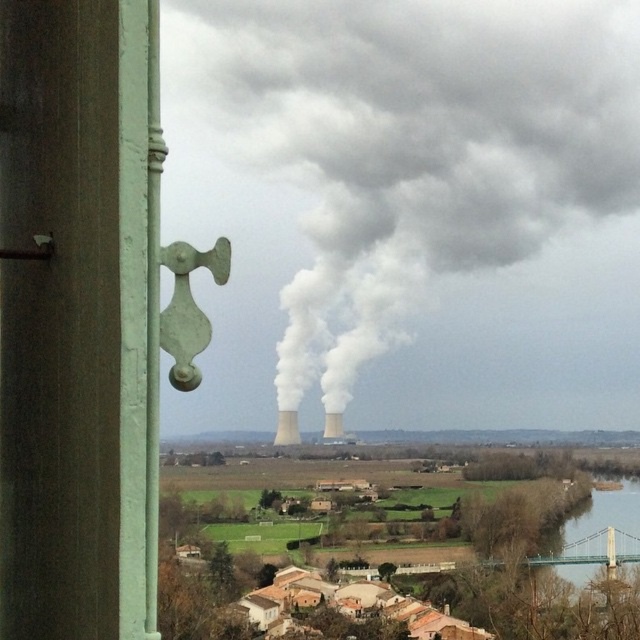
Where is `smooth concrete chimney at center`? The image size is (640, 640). smooth concrete chimney at center is located at coordinates (285, 428).

From the picture: Between smooth concrete chimney at center and white matte tower at center, which one is positioned lower?

Positioned lower is smooth concrete chimney at center.

Who is more forward, (x=278, y=444) or (x=339, y=428)?

Point (x=339, y=428) is more forward.

Find the location of a particular element. smooth concrete chimney at center is located at coordinates (285, 428).

Who is more distant from viewer, (419, 141) or (326, 426)?

The point (419, 141) is more distant.

Describe the element at coordinates (428, 195) in the screenshot. I see `white smoke at center` at that location.

Measure the distance between point (388, 109) and camera.

Point (388, 109) and camera are 300.20 meters apart.

Where is `white smoke at center`? The width and height of the screenshot is (640, 640). white smoke at center is located at coordinates (428, 195).

Between white smoke at center and smooth concrete chimney at center, which one is positioned lower?

smooth concrete chimney at center

Does white smoke at center appear on the left side of smooth concrete chimney at center?

No, white smoke at center is not to the left of smooth concrete chimney at center.

The height and width of the screenshot is (640, 640). I want to click on white smoke at center, so click(x=428, y=195).